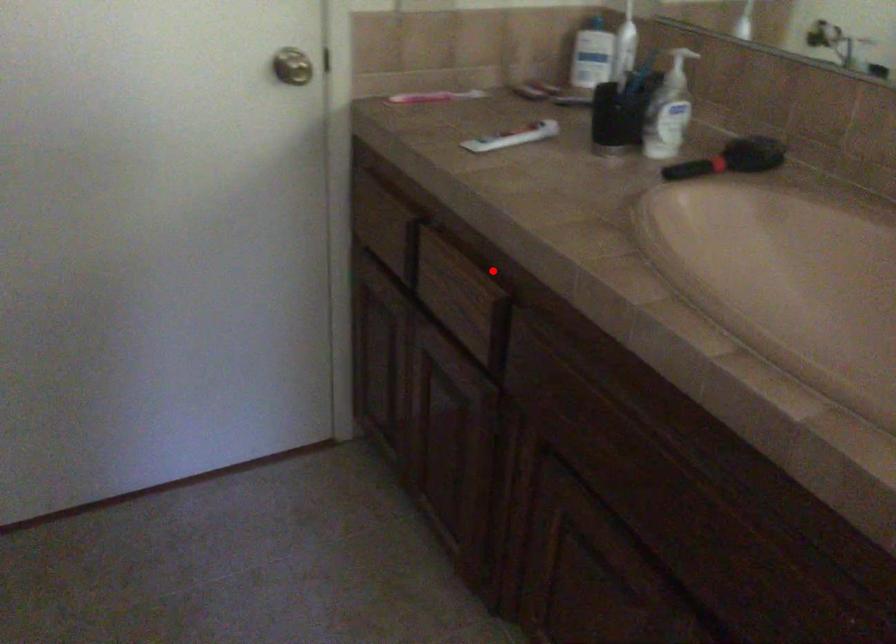
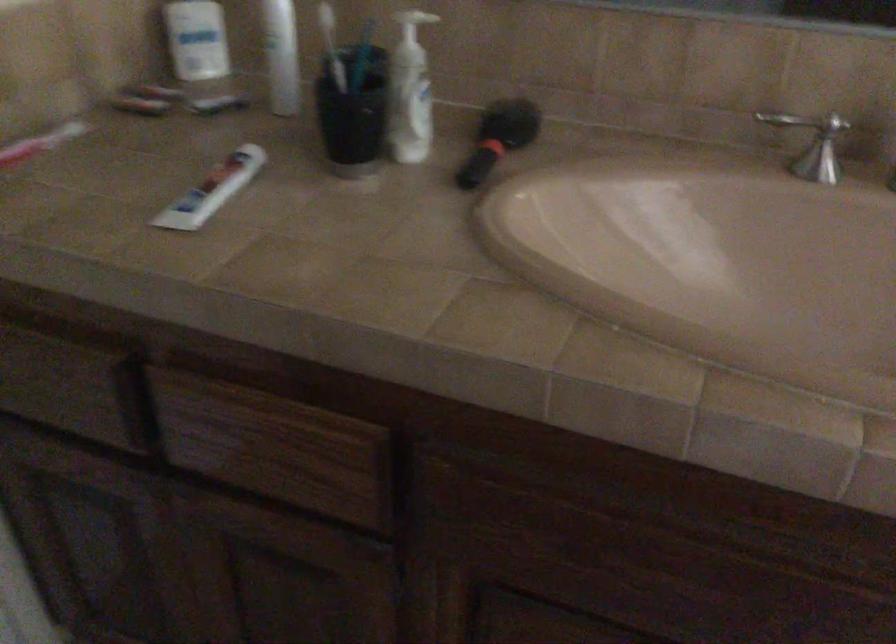
Question: A red point is marked in image1. In image2, is the corresponding 3D point closer to the camera or farther? Reply with the corresponding letter.

Choices:
 (A) The corresponding 3D point is closer.
 (B) The corresponding 3D point is farther.

Answer: (A)